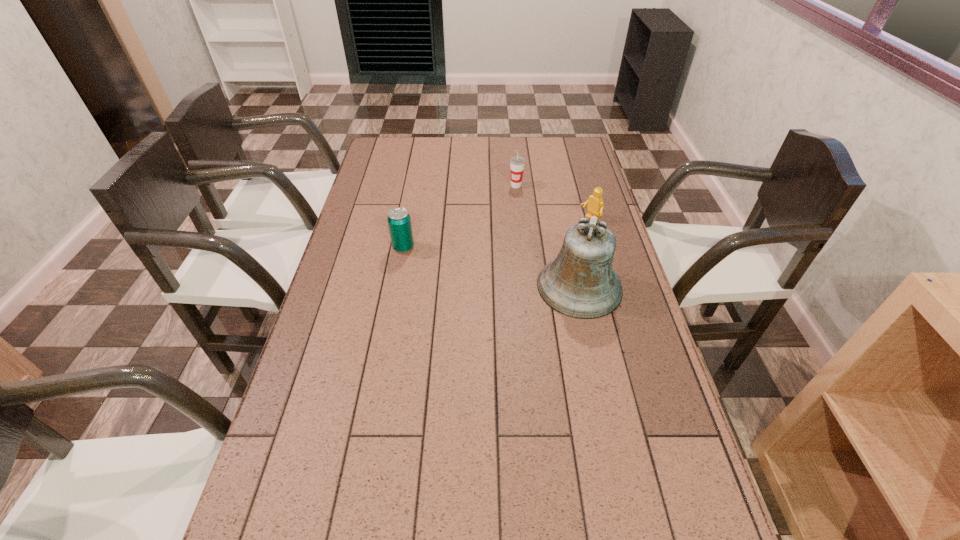
Locate an element on the screen. the leftmost object is located at coordinates pos(399,221).

At what (x,y) coordinates should I click in order to perform the action: click on the third farthest object. Please return your answer as a coordinate pair (x, y). Looking at the image, I should click on (399, 221).

I want to click on the nearest object, so click(x=580, y=283).

At what (x,y) coordinates should I click in order to perform the action: click on the tallest object. Please return your answer as a coordinate pair (x, y). This screenshot has height=540, width=960. Looking at the image, I should click on 580,283.

This screenshot has width=960, height=540. I want to click on the farthest object, so click(517, 163).

You are a GUI agent. You are given a task and a screenshot of the screen. Output one action in this format:
    pyautogui.click(x=<x>, y=<y>)
    Task: Click on the cup
    The height and width of the screenshot is (540, 960).
    Given the screenshot: What is the action you would take?
    pyautogui.click(x=517, y=163)

Locate an element on the screen. This screenshot has width=960, height=540. the second farthest object is located at coordinates (595, 206).

Image resolution: width=960 pixels, height=540 pixels. Find the location of `vacant space located on the left of the beer can`. vacant space located on the left of the beer can is located at coordinates (x=362, y=247).

This screenshot has height=540, width=960. I want to click on vacant region located on the front of the bell, so click(605, 404).

Identify the location of vacant space located 0.070m on the side of the farthest object with the logo. The height and width of the screenshot is (540, 960). (516, 200).